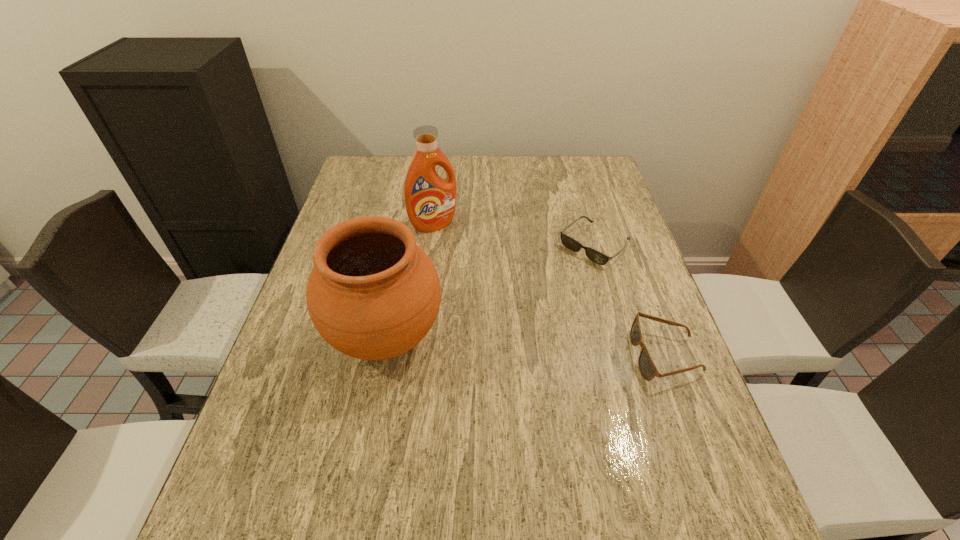
Where is `vacant space located 0.260m on the front-facing side of the detergent`? The image size is (960, 540). vacant space located 0.260m on the front-facing side of the detergent is located at coordinates (490, 288).

The width and height of the screenshot is (960, 540). I want to click on vacant space located on the front-facing side of the detergent, so click(x=513, y=316).

Find the location of a particular element. The width and height of the screenshot is (960, 540). vacant space located 0.270m on the front-facing side of the detergent is located at coordinates (492, 291).

Locate an element on the screen. This screenshot has height=540, width=960. free spot located on the front-facing side of the shorter sunglasses is located at coordinates (501, 327).

The height and width of the screenshot is (540, 960). I want to click on free space located 0.240m on the front-facing side of the shorter sunglasses, so pyautogui.click(x=519, y=311).

You are a GUI agent. You are given a task and a screenshot of the screen. Output one action in this format:
    pyautogui.click(x=<x>, y=<y>)
    Task: Click on the vacant space located 0.180m on the front-facing side of the shorter sunglasses
    This screenshot has width=960, height=540.
    Given the screenshot: What is the action you would take?
    pyautogui.click(x=535, y=298)

The width and height of the screenshot is (960, 540). I want to click on object that is at the left edge, so click(x=373, y=294).

Find the location of `free space at the far edge of the desktop`. free space at the far edge of the desktop is located at coordinates (469, 157).

In the image, there is a desktop. Identify the location of vacant space at the near edge. Image resolution: width=960 pixels, height=540 pixels. (416, 489).

In the image, there is a desktop. Where is `free region at the left edge`? Image resolution: width=960 pixels, height=540 pixels. free region at the left edge is located at coordinates coord(388,201).